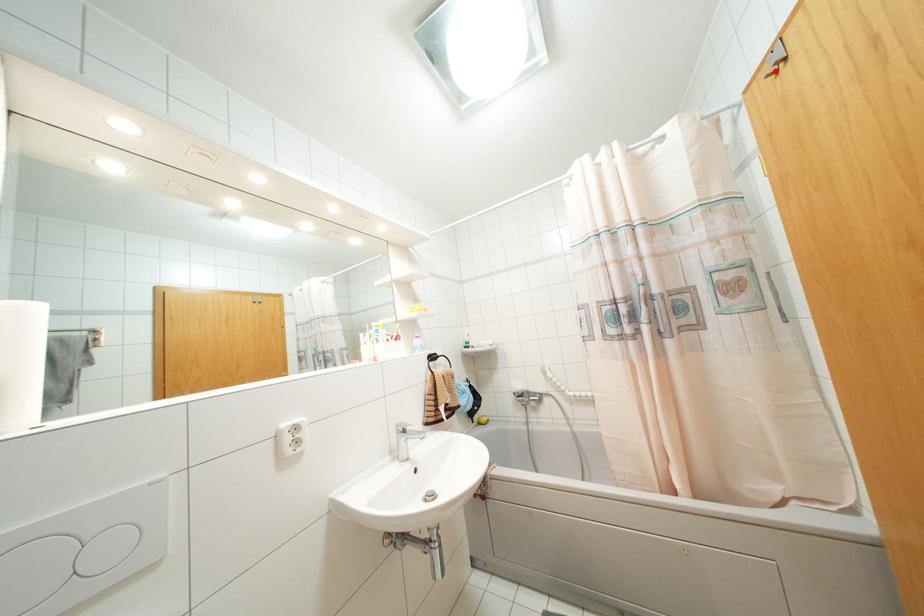
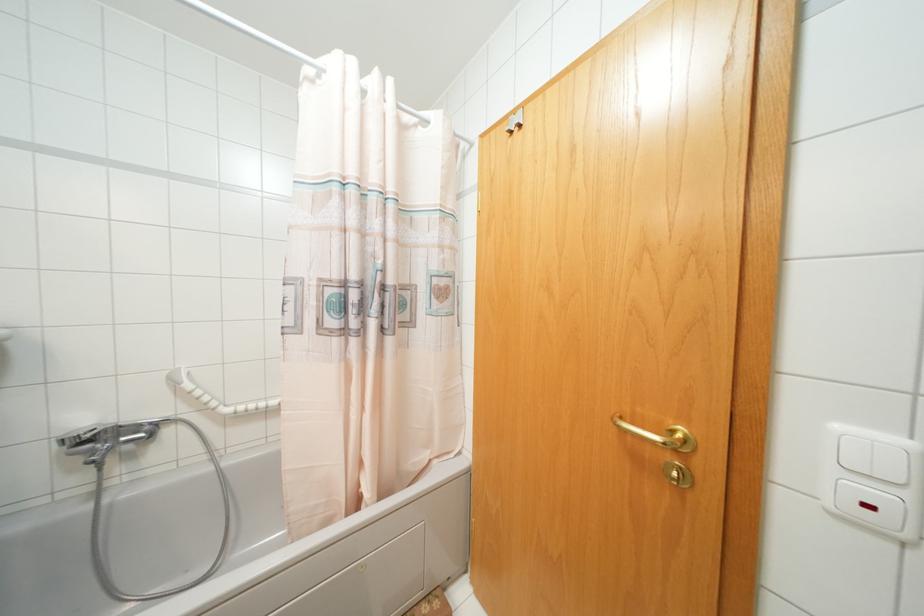
In the second image, find the point that corresponds to the highlighted location in the first image.

(511, 132)